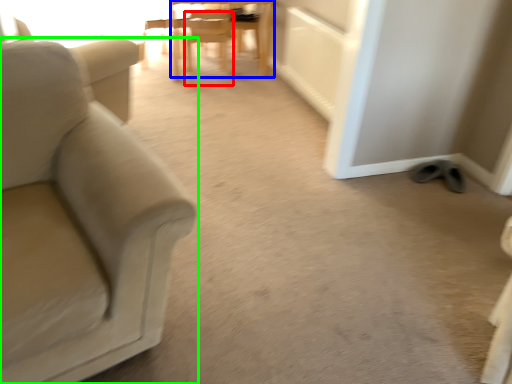
Question: Which object is the closest to the chair (highlighted by a red box)? Choose among these: chair (highlighted by a blue box) or chair (highlighted by a green box).

Choices:
 (A) chair
 (B) chair

Answer: (A)